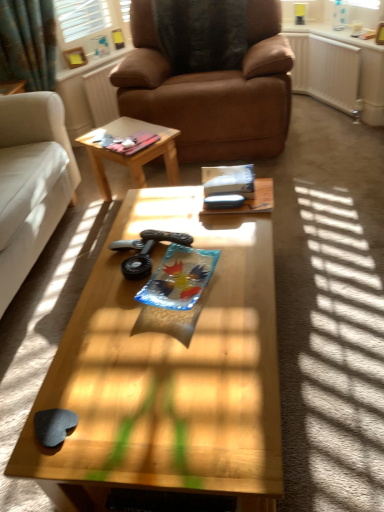
Question: Considering the positions of brown leather chair at center and brown leather radiator at upper center, the 2th radiator in the right-to-left sequence, in the image, is brown leather chair at center wider or thinner than brown leather radiator at upper center, the 2th radiator in the right-to-left sequence,?

Choices:
 (A) thin
 (B) wide

Answer: (B)

Question: Is point (152, 56) positioned closer to the camera than point (102, 79)?

Choices:
 (A) farther
 (B) closer

Answer: (B)

Question: Estimate the real-world distances between objects in this image. Which object is closer to the wooden coffee table at center, acting as the second coffee table starting from the back?

Choices:
 (A) brown leather radiator at upper center, acting as the first radiator starting from the left
 (B) white plastic radiator at upper right, placed as the first radiator when sorted from right to left
 (C) black plastic game controller at center
 (D) wooden at center, acting as the first coffee table starting from the back
 (E) white fabric studio couch at left

Answer: (C)

Question: Which object is positioned farthest from the brown leather radiator at upper center, the 2th radiator in the right-to-left sequence?

Choices:
 (A) black plastic game controller at center
 (B) white fabric studio couch at left
 (C) wooden coffee table at center, which is the first coffee table in front-to-back order
 (D) white plastic radiator at upper right, arranged as the second radiator when viewed from the left
 (E) wooden at center, the 2th coffee table from the front

Answer: (C)